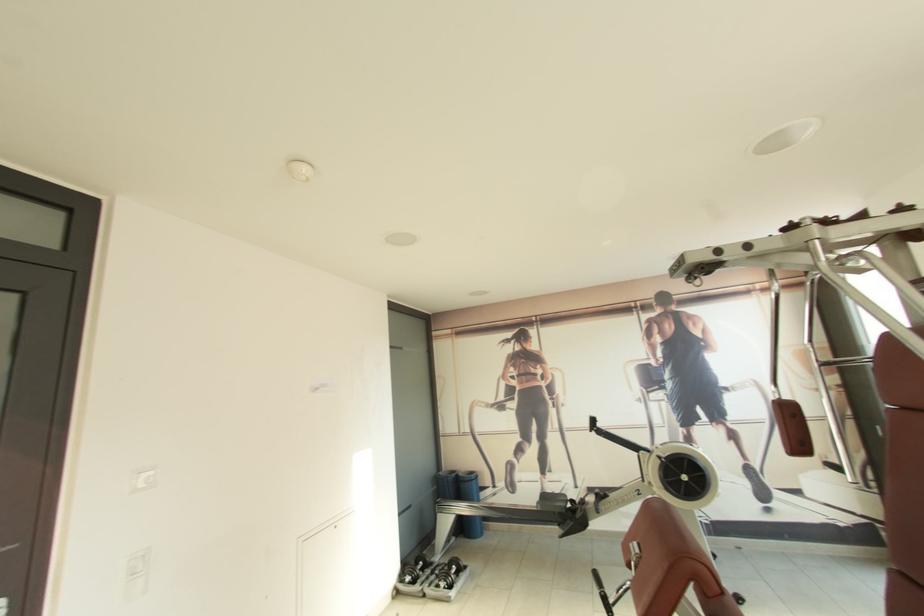
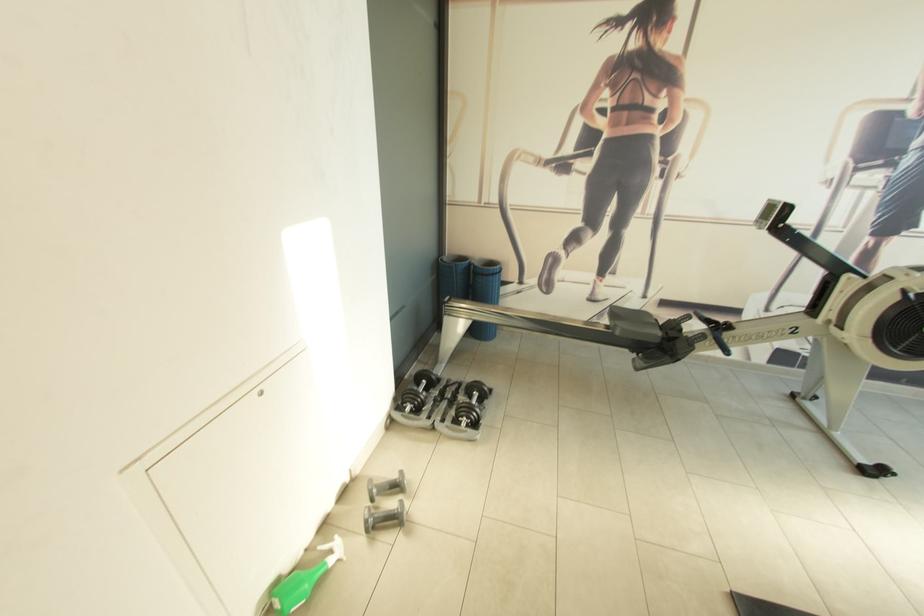
Find the pixel in the second image that matches point (543, 509) in the first image.

(622, 334)